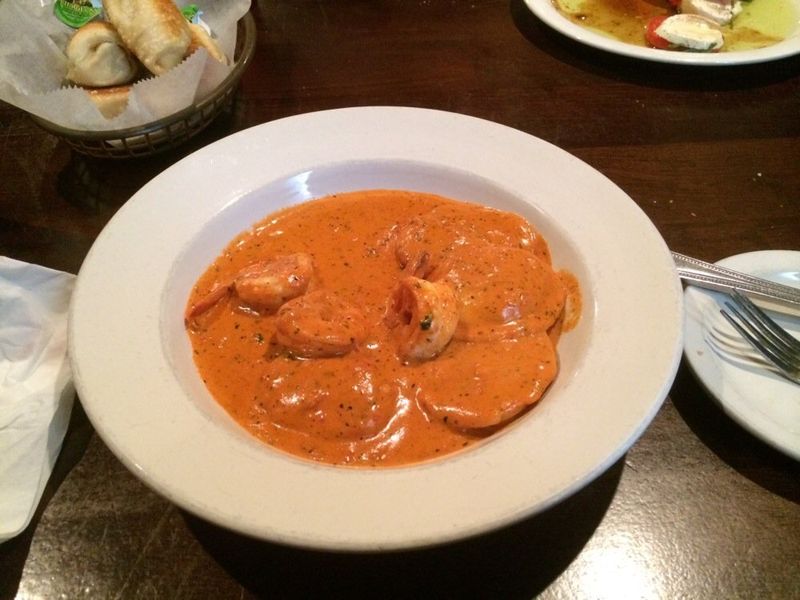
I want to click on napkin, so click(x=30, y=364).